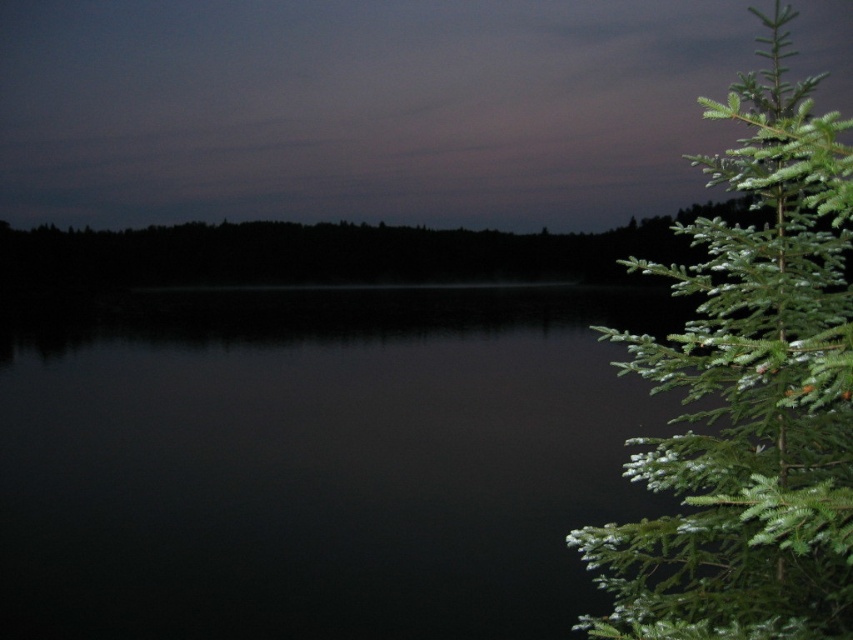
You are standing in the nighttime scene by the water and want to determine which of the two points, point (64, 333) or point (779, 609), is closer to you. Based on the scene description, which point is nearer?

Point (64, 333) is further to the viewer than point (779, 609), so the closer point is point (779, 609).